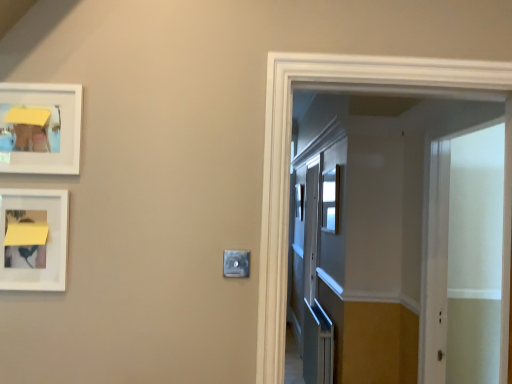
Question: Is clear glass window at center to the right of white translucent screen door at right from the viewer's perspective?

Choices:
 (A) yes
 (B) no

Answer: (B)

Question: Does clear glass window at center have a lesser width compared to white translucent screen door at right?

Choices:
 (A) yes
 (B) no

Answer: (A)

Question: Is clear glass window at center aimed at white translucent screen door at right?

Choices:
 (A) yes
 (B) no

Answer: (B)

Question: Considering the relative sizes of clear glass window at center and white translucent screen door at right in the image provided, is clear glass window at center bigger than white translucent screen door at right?

Choices:
 (A) yes
 (B) no

Answer: (B)

Question: Is clear glass window at center next to white translucent screen door at right and touching it?

Choices:
 (A) no
 (B) yes

Answer: (A)

Question: Can you confirm if clear glass window at center is wider than white translucent screen door at right?

Choices:
 (A) yes
 (B) no

Answer: (B)

Question: Is white translucent screen door at right oriented away from white matte picture frame at upper left, the 1th picture frame from the top?

Choices:
 (A) yes
 (B) no

Answer: (B)

Question: Would you say white matte picture frame at upper left, which appears as the second picture frame when ordered from the bottom, is part of white translucent screen door at right's contents?

Choices:
 (A) no
 (B) yes

Answer: (A)

Question: Considering the relative sizes of white translucent screen door at right and white matte picture frame at upper left, which appears as the second picture frame when ordered from the bottom, in the image provided, is white translucent screen door at right shorter than white matte picture frame at upper left, which appears as the second picture frame when ordered from the bottom,?

Choices:
 (A) yes
 (B) no

Answer: (B)

Question: Does white translucent screen door at right appear on the right side of white matte picture frame at upper left, the 1th picture frame from the top?

Choices:
 (A) no
 (B) yes

Answer: (B)

Question: Is white translucent screen door at right directly adjacent to white matte picture frame at upper left, which appears as the second picture frame when ordered from the bottom?

Choices:
 (A) no
 (B) yes

Answer: (A)

Question: Considering the relative sizes of white translucent screen door at right and white matte picture frame at upper left, the 1th picture frame from the top, in the image provided, is white translucent screen door at right taller than white matte picture frame at upper left, the 1th picture frame from the top,?

Choices:
 (A) no
 (B) yes

Answer: (B)

Question: Can you confirm if white matte picture frame at left, marked as the 1th picture frame in a bottom-to-top arrangement, is thinner than satin silver switch at center?

Choices:
 (A) no
 (B) yes

Answer: (A)